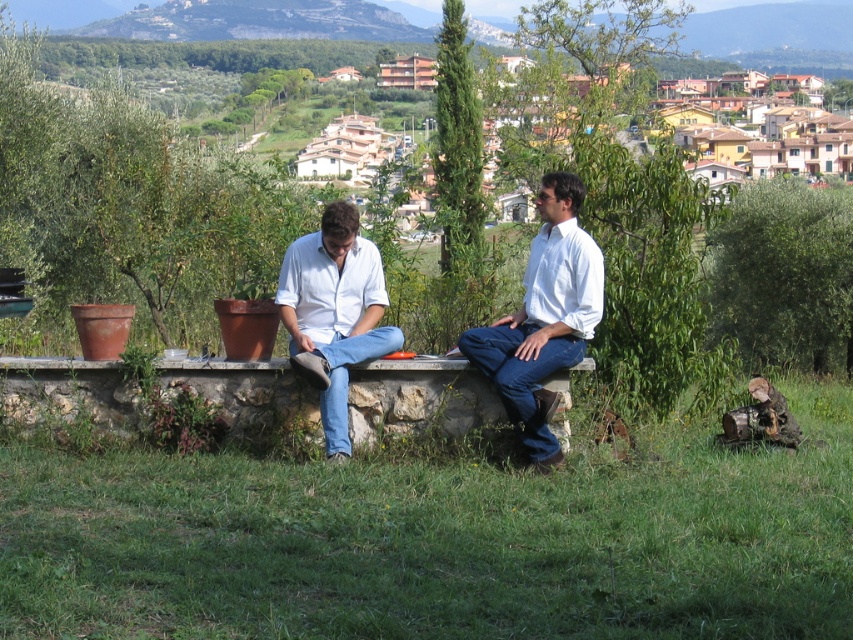
Consider the image. Is smooth stone ledge at center wider than white cotton shirt at center?

Indeed, smooth stone ledge at center has a greater width compared to white cotton shirt at center.

What do you see at coordinates (419, 400) in the screenshot? I see `smooth stone ledge at center` at bounding box center [419, 400].

Find the location of a particular element. The image size is (853, 640). smooth stone ledge at center is located at coordinates coord(419,400).

Between white cotton shirt at center and white smooth shirt at center, which one appears on the left side from the viewer's perspective?

From the viewer's perspective, white cotton shirt at center appears more on the left side.

Between point (550, 326) and point (553, 192), which one is positioned in front?

Point (550, 326)

Is point (584, 248) closer to camera compared to point (546, 259)?

That is True.

Image resolution: width=853 pixels, height=640 pixels. Find the location of `white cotton shirt at center`. white cotton shirt at center is located at coordinates (543, 320).

Who is more forward, [827,348] or [318,342]?

Point [318,342]

Is point (766, 276) closer to viewer compared to point (315, 314)?

No, it is behind (315, 314).

You are a GUI agent. You are given a task and a screenshot of the screen. Output one action in this format:
    pyautogui.click(x=<x>, y=<y>)
    Task: Click on the green leafy tree at right
    This screenshot has width=853, height=640.
    Given the screenshot: What is the action you would take?
    pos(784,275)